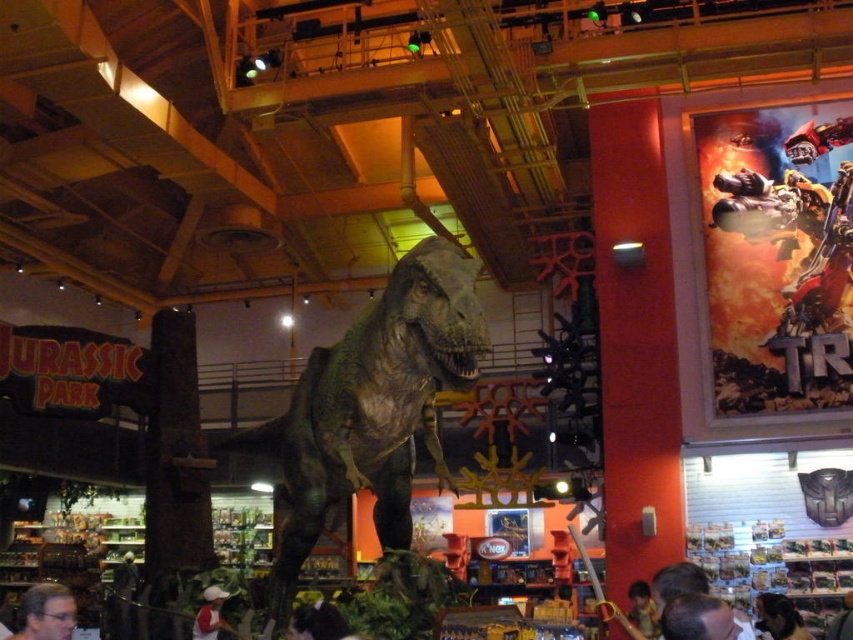
You are a customer in the store and want to know which hairstyle is closer to the entrance. The entrance is on the left side of the store. Which hairstyle, matte black hair at lower left or dark brown hair at lower right, is closer to the entrance?

The matte black hair at lower left is closer to the entrance since it is positioned to the left of the dark brown hair at lower right and the entrance is on the left side of the store.

Based on the photo, you are a customer in the store and want to know which person has hair that reaches higher. You see two people at the lower right of the image with dark brown hair at lower right and light brown hair at lower right. Which one has hair that reaches a higher point?

The dark brown hair at lower right is taller than light brown hair at lower right, so the person with dark brown hair at lower right has hair that reaches a higher point.

You are standing in the retail store and want to know how far the point at coordinates (714,154) is from your current position. Can you determine the distance?

The point at coordinates (714,154) is 38.14 feet away from the camera, so the distance from your current position would be approximately 38.14 feet.